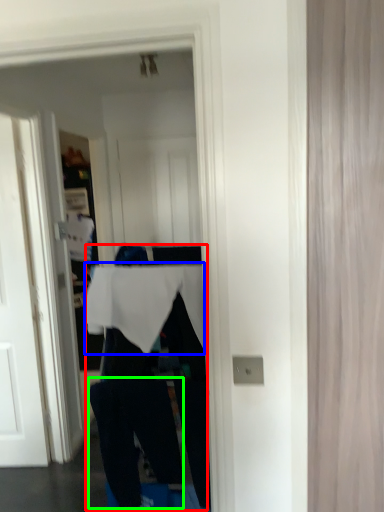
Question: Estimate the real-world distances between objects in this image. Which object is closer to person (highlighted by a red box), tablecloth (highlighted by a blue box) or trousers (highlighted by a green box)?

Choices:
 (A) tablecloth
 (B) trousers

Answer: (B)